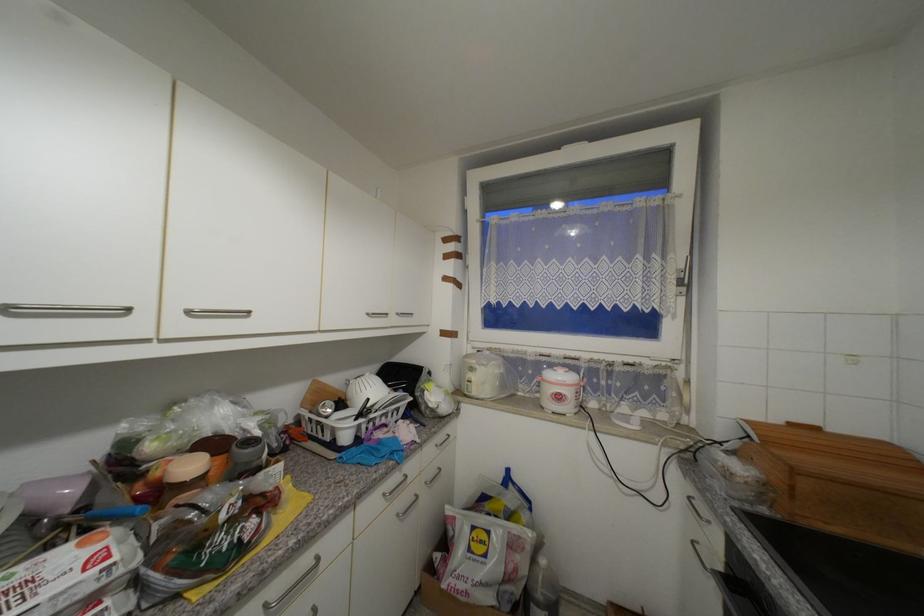
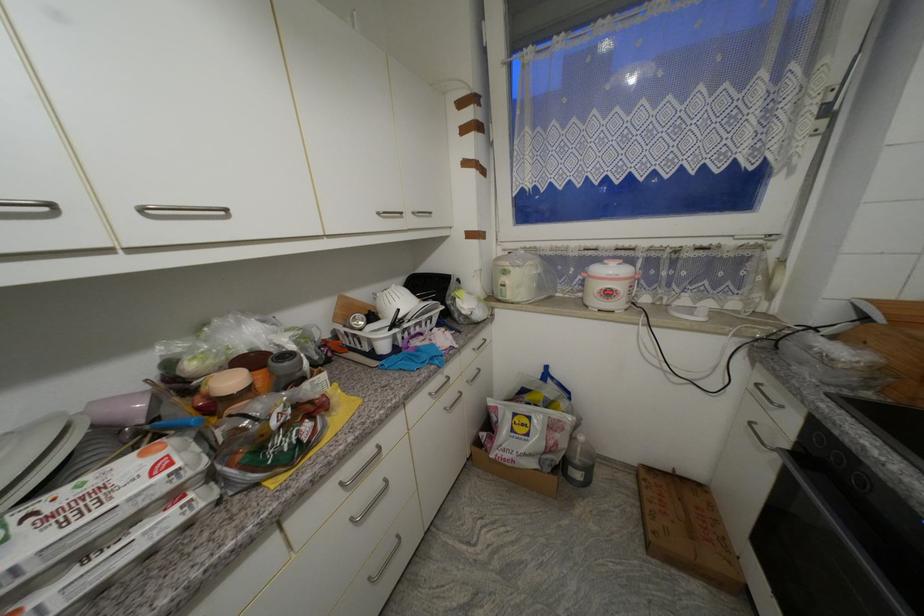
Locate, in the second image, the point that corresponds to point 373,315 in the first image.

(383, 215)